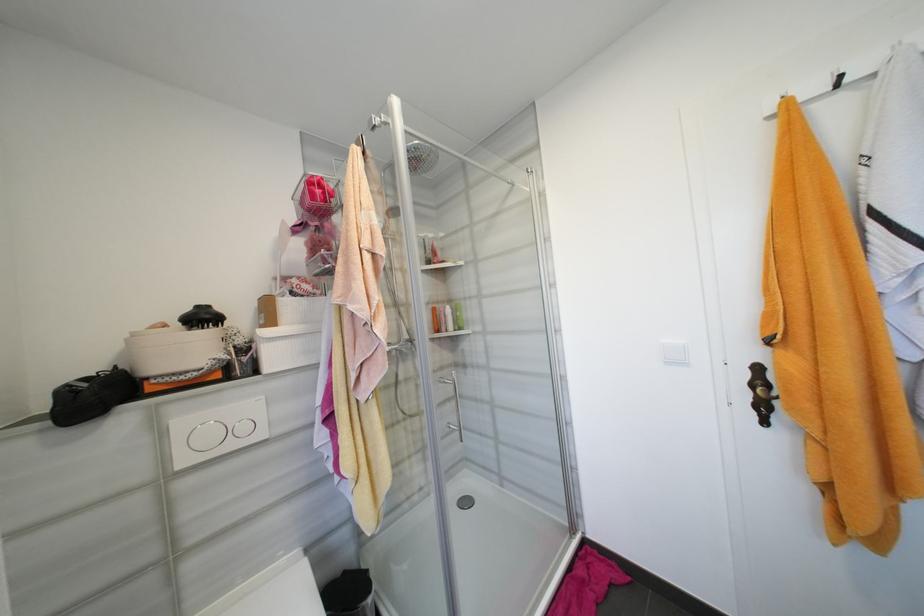
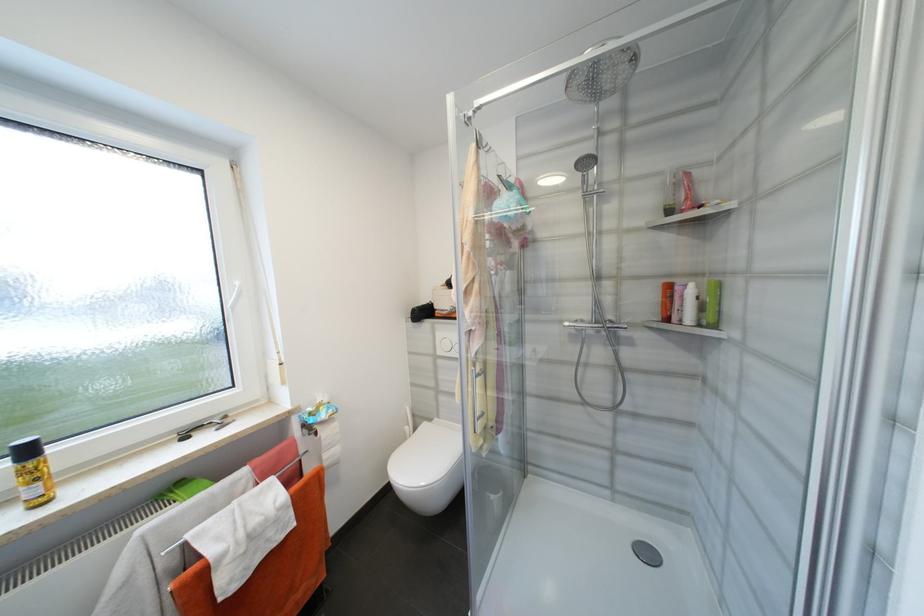
Where in the second image is the point corresponding to [189,463] from the first image?

(445, 353)